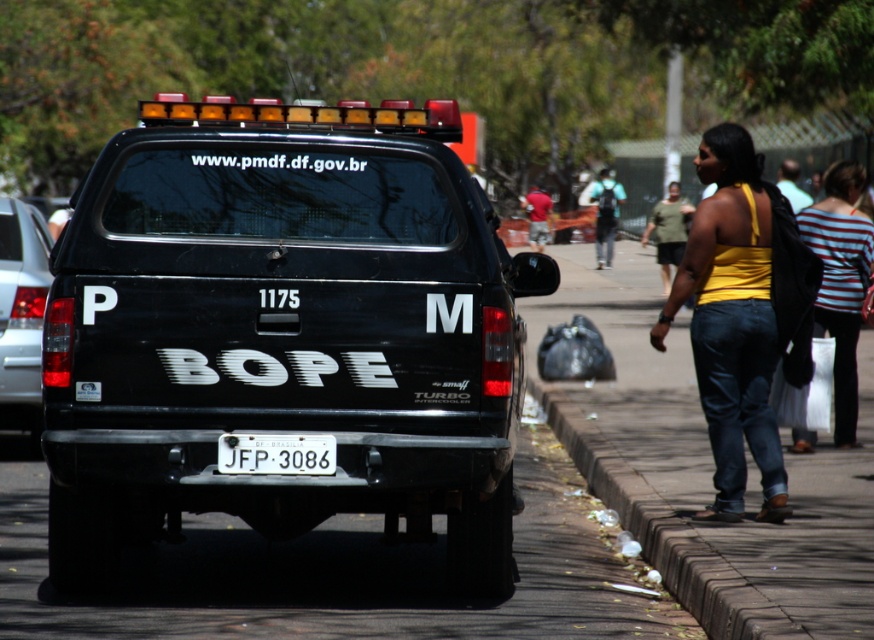
Question: Is striped cotton shirt at center to the left of red cotton shirt at center from the viewer's perspective?

Choices:
 (A) yes
 (B) no

Answer: (B)

Question: Is the position of black matte truck at center less distant than that of smooth concrete sidewalk at lower right?

Choices:
 (A) no
 (B) yes

Answer: (A)

Question: From the image, what is the correct spatial relationship of black matte truck at center in relation to smooth concrete sidewalk at lower right?

Choices:
 (A) left
 (B) right

Answer: (A)

Question: Which point is closer to the camera?

Choices:
 (A) (160, 481)
 (B) (269, 435)
 (C) (614, 314)

Answer: (B)

Question: Which object is the farthest from the green cotton shirt at right?

Choices:
 (A) matte black truck at right
 (B) white plastic license plate at center

Answer: (A)

Question: Which point is closer to the camera?

Choices:
 (A) green cotton shirt at right
 (B) matte black truck at right

Answer: (B)